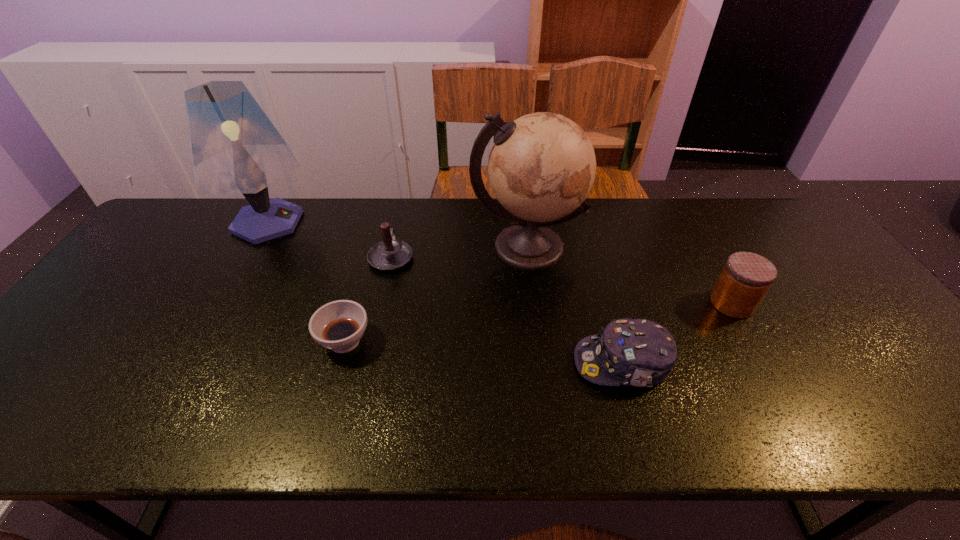
The height and width of the screenshot is (540, 960). In order to click on free space at the far edge of the desktop in this screenshot , I will do `click(460, 243)`.

Where is `free space at the near edge`? free space at the near edge is located at coordinates (394, 439).

Locate an element on the screen. The height and width of the screenshot is (540, 960). free spot at the right edge of the desktop is located at coordinates (x=891, y=390).

Where is `free point between the second shortest object and the leftmost object`? free point between the second shortest object and the leftmost object is located at coordinates (444, 293).

You are a GUI agent. You are given a task and a screenshot of the screen. Output one action in this format:
    pyautogui.click(x=<x>, y=<y>)
    Task: Click on the free space between the globe and the candle
    The width and height of the screenshot is (960, 540).
    Given the screenshot: What is the action you would take?
    pyautogui.click(x=459, y=252)

Image resolution: width=960 pixels, height=540 pixels. What are the coordinates of `free spot between the shortest object and the leftmost object` in the screenshot? It's located at (306, 281).

The image size is (960, 540). Find the location of `blank region between the headwear and the globe`. blank region between the headwear and the globe is located at coordinates (574, 305).

This screenshot has width=960, height=540. Find the location of `free area in between the candle and the globe`. free area in between the candle and the globe is located at coordinates (459, 252).

Identify the location of free space between the soup bowl and the candle. This screenshot has height=540, width=960. (368, 299).

The width and height of the screenshot is (960, 540). I want to click on unoccupied position between the headwear and the soup bowl, so click(x=484, y=352).